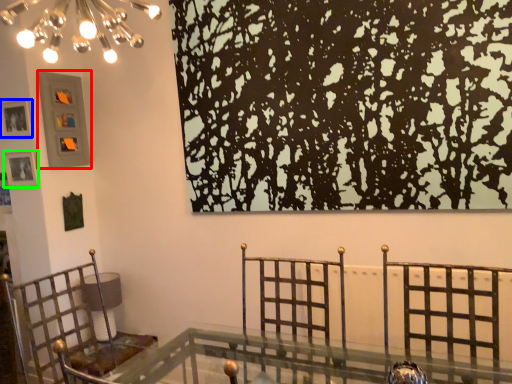
Question: Which object is the farthest from picture frame (highlighted by a red box)? Choose among these: picture frame (highlighted by a blue box) or picture frame (highlighted by a green box).

Choices:
 (A) picture frame
 (B) picture frame

Answer: (B)